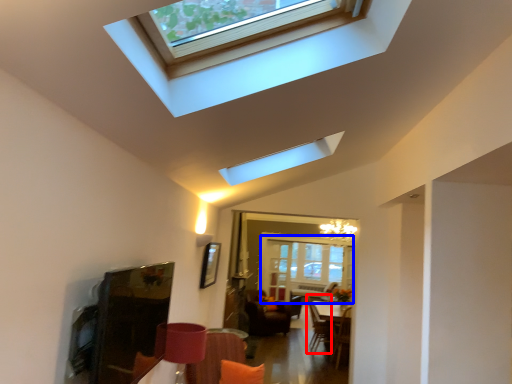
Question: Which of the following is the closest to the observer, swivel chair (highlighted by a red box) or glass door (highlighted by a blue box)?

Choices:
 (A) swivel chair
 (B) glass door

Answer: (A)